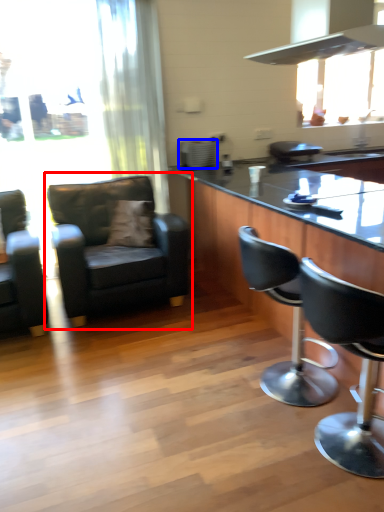
Question: Which object is closer to the camera taking this photo, chair (highlighted by a red box) or appliance (highlighted by a blue box)?

Choices:
 (A) chair
 (B) appliance

Answer: (A)